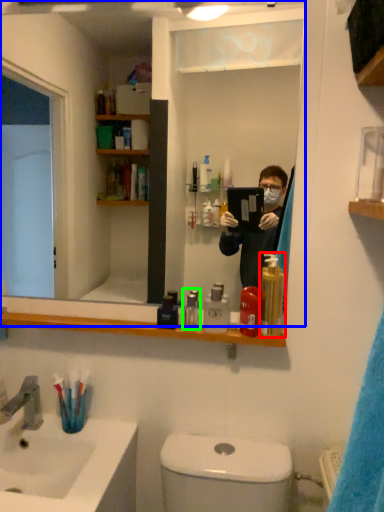
Question: Considering the real-world distances, which object is closest to soap dispenser (highlighted by a red box)? mirror (highlighted by a blue box) or mouthwash (highlighted by a green box).

Choices:
 (A) mirror
 (B) mouthwash

Answer: (B)